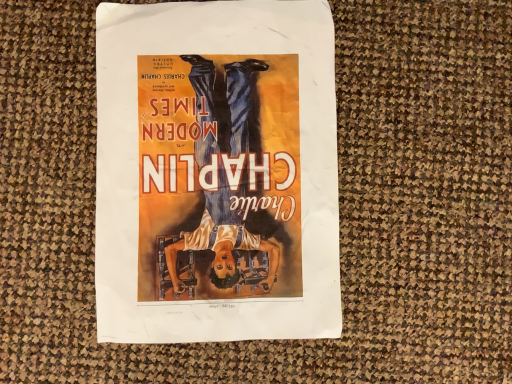
Find the location of a particular element. The image size is (512, 384). free space above matte paper poster at center (from a real-world perspective) is located at coordinates (206, 182).